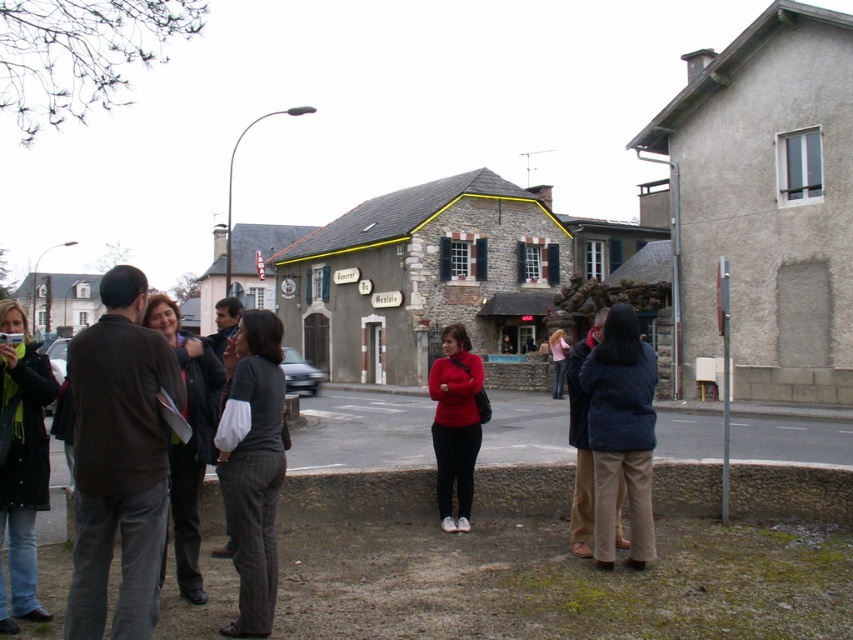
Question: Can you confirm if gray pinstripe pants at center is bigger than dark gray sweater at center?

Choices:
 (A) no
 (B) yes

Answer: (A)

Question: Which object is farther from the camera taking this photo?

Choices:
 (A) dark gray pants at center
 (B) matte red sweater at center
 (C) dark brown jacket at left

Answer: (B)

Question: Which point is farther to the camera?

Choices:
 (A) [x=256, y=464]
 (B) [x=190, y=529]

Answer: (B)

Question: Considering the relative positions of gray pinstripe pants at center and matte red sweater at center in the image provided, where is gray pinstripe pants at center located with respect to matte red sweater at center?

Choices:
 (A) left
 (B) right

Answer: (A)

Question: Is dark brown jacket at left to the left of matte red sweater at center from the viewer's perspective?

Choices:
 (A) no
 (B) yes

Answer: (B)

Question: Which of the following is the farthest from the observer?

Choices:
 (A) matte red sweater at center
 (B) dark brown jacket at left
 (C) blue quilted jacket at center
 (D) pink fabric shirt at center

Answer: (D)